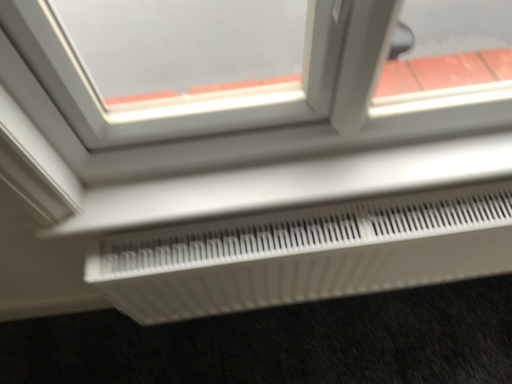
Question: Should I look upward or downward to see white plastic radiator at lower center?

Choices:
 (A) down
 (B) up

Answer: (A)

Question: Is white plastic radiator at lower center positioned in front of white plastic radiator at lower center?

Choices:
 (A) yes
 (B) no

Answer: (A)

Question: Is white plastic radiator at lower center thinner than white plastic radiator at lower center?

Choices:
 (A) no
 (B) yes

Answer: (A)

Question: Is white plastic radiator at lower center bigger than white plastic radiator at lower center?

Choices:
 (A) no
 (B) yes

Answer: (A)

Question: From a real-world perspective, does white plastic radiator at lower center stand above white plastic radiator at lower center?

Choices:
 (A) no
 (B) yes

Answer: (B)

Question: Considering the relative sizes of white plastic radiator at lower center and white plastic radiator at lower center in the image provided, is white plastic radiator at lower center taller than white plastic radiator at lower center?

Choices:
 (A) no
 (B) yes

Answer: (A)

Question: Is the depth of white plastic radiator at lower center greater than that of white plastic radiator at lower center?

Choices:
 (A) yes
 (B) no

Answer: (B)

Question: Is white plastic radiator at lower center located outside white plastic radiator at lower center?

Choices:
 (A) no
 (B) yes

Answer: (B)

Question: Is white plastic radiator at lower center looking in the opposite direction of white plastic radiator at lower center?

Choices:
 (A) no
 (B) yes

Answer: (A)

Question: Does white plastic radiator at lower center have a larger size compared to white plastic radiator at lower center?

Choices:
 (A) yes
 (B) no

Answer: (A)

Question: Can you confirm if white plastic radiator at lower center is positioned to the left of white plastic radiator at lower center?

Choices:
 (A) no
 (B) yes

Answer: (A)

Question: Is white plastic radiator at lower center far from white plastic radiator at lower center?

Choices:
 (A) yes
 (B) no

Answer: (B)

Question: Considering the relative positions of white plastic radiator at lower center and white plastic radiator at lower center in the image provided, is white plastic radiator at lower center in front of white plastic radiator at lower center?

Choices:
 (A) yes
 (B) no

Answer: (B)

Question: Is white plastic radiator at lower center inside or outside of white plastic radiator at lower center?

Choices:
 (A) outside
 (B) inside

Answer: (A)